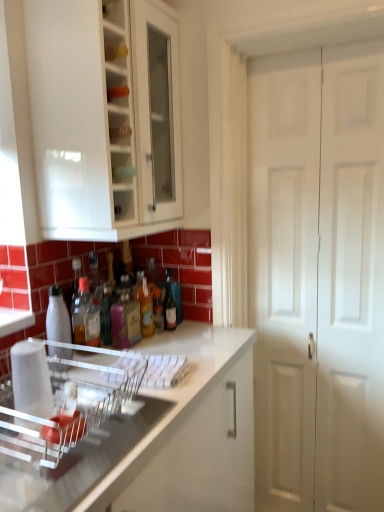
Question: From the image's perspective, is translucent plastic bottle at center, which is counted as the second bottle, starting from the right, positioned above or below clear plastic dish rack at center?

Choices:
 (A) below
 (B) above

Answer: (B)

Question: In the image, is translucent plastic bottle at center, positioned as the 5th bottle in left-to-right order, positioned in front of or behind clear plastic dish rack at center?

Choices:
 (A) behind
 (B) front

Answer: (A)

Question: Estimate the real-world distances between objects in this image. Which object is closer to the white glossy cabinet at upper left?

Choices:
 (A) translucent plastic bottle at center, which is counted as the second bottle, starting from the right
 (B) matte glass bottle at center, the sixth bottle when ordered from left to right
 (C) translucent plastic bottle at center, the fifth bottle in the right-to-left sequence
 (D) translucent glass bottle at center, the 3th bottle when ordered from right to left
 (E) clear plastic dish rack at lower left

Answer: (C)

Question: Estimate the real-world distances between objects in this image. Which object is closer to the translucent glass bottle at center, the 3th bottle when ordered from right to left?

Choices:
 (A) translucent plastic bottle at center, positioned as the 5th bottle in left-to-right order
 (B) white glossy cabinet at upper left
 (C) white matte door at right
 (D) pink matte bottle at center, marked as the 4th bottle in a right-to-left arrangement
 (E) translucent plastic bottle at center, the second bottle in the left-to-right sequence

Answer: (A)